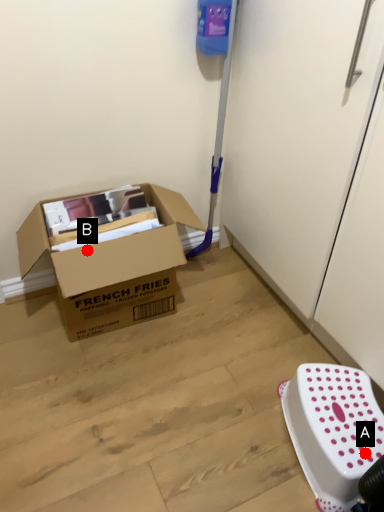
Question: Two points are circled on the image, labeled by A and B beside each circle. Which point is farther to the camera?

Choices:
 (A) A is further
 (B) B is further

Answer: (B)